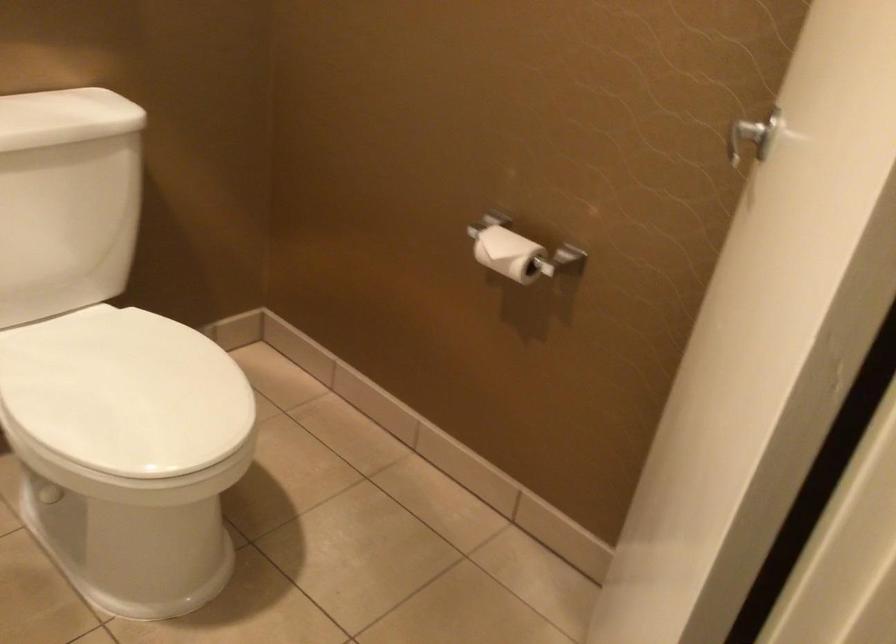
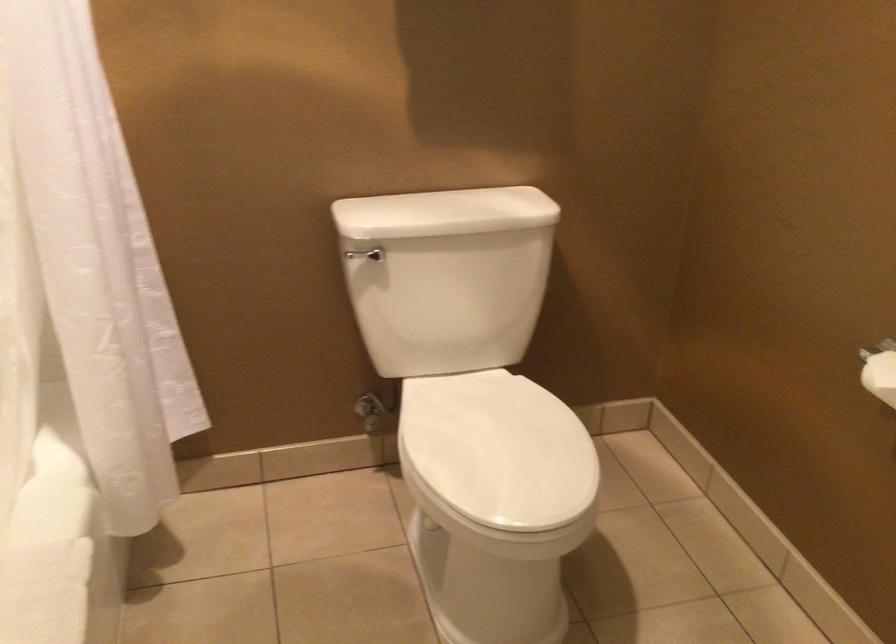
Question: The camera is either moving clockwise (left) or counter-clockwise (right) around the object. The first image is from the beginning of the video and the second image is from the end. Is the camera moving left or right when shooting the video?

Choices:
 (A) Left
 (B) Right

Answer: (B)